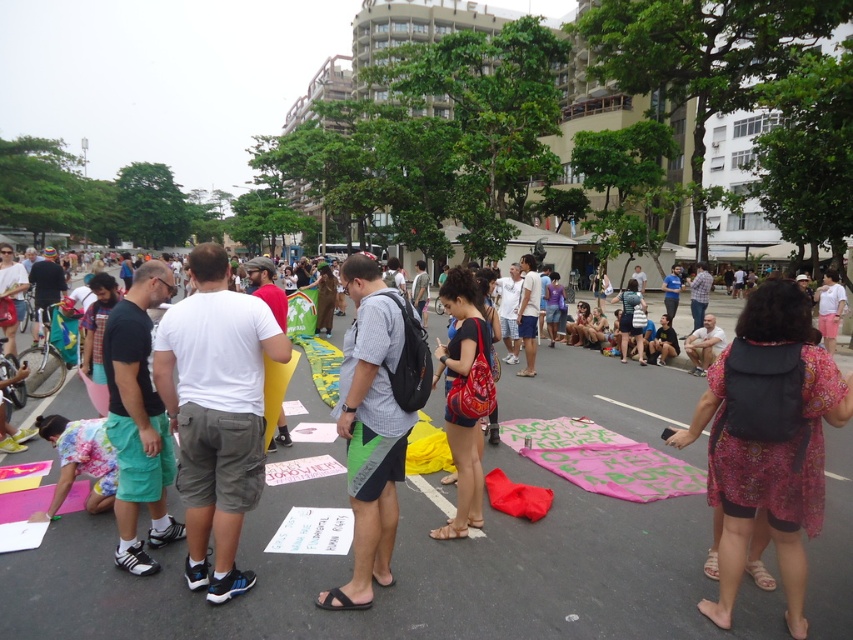
Can you confirm if printed cotton dress at center is wider than checkered fabric shirt at center?

Yes.

Does printed cotton dress at center have a smaller size compared to checkered fabric shirt at center?

No, printed cotton dress at center is not smaller than checkered fabric shirt at center.

The image size is (853, 640). I want to click on printed cotton dress at center, so click(x=769, y=451).

Can you confirm if white cotton t-shirt at center is positioned to the right of printed cotton dress at center?

No, white cotton t-shirt at center is not to the right of printed cotton dress at center.

Can you confirm if white cotton t-shirt at center is positioned above printed cotton dress at center?

Yes.

What do you see at coordinates (216, 413) in the screenshot? Image resolution: width=853 pixels, height=640 pixels. I see `white cotton t-shirt at center` at bounding box center [216, 413].

Identify the location of white cotton t-shirt at center. The width and height of the screenshot is (853, 640). (x=216, y=413).

Which is behind, point (238, 380) or point (397, 500)?

The point (397, 500) is behind.

The height and width of the screenshot is (640, 853). What do you see at coordinates (216, 413) in the screenshot?
I see `white cotton t-shirt at center` at bounding box center [216, 413].

Find the location of a particular element. white cotton t-shirt at center is located at coordinates (216, 413).